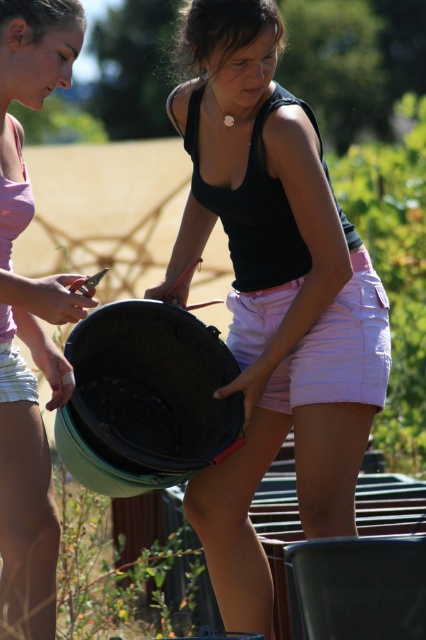
Does matte black bucket at center appear under matte black bucket at lower left?

Incorrect, matte black bucket at center is not positioned below matte black bucket at lower left.

How much distance is there between matte black bucket at center and matte black bucket at lower left?

matte black bucket at center is 60.00 centimeters away from matte black bucket at lower left.

Is point (201, 93) less distant than point (39, 515)?

No, (201, 93) is behind (39, 515).

The width and height of the screenshot is (426, 640). I want to click on matte black bucket at center, so click(273, 294).